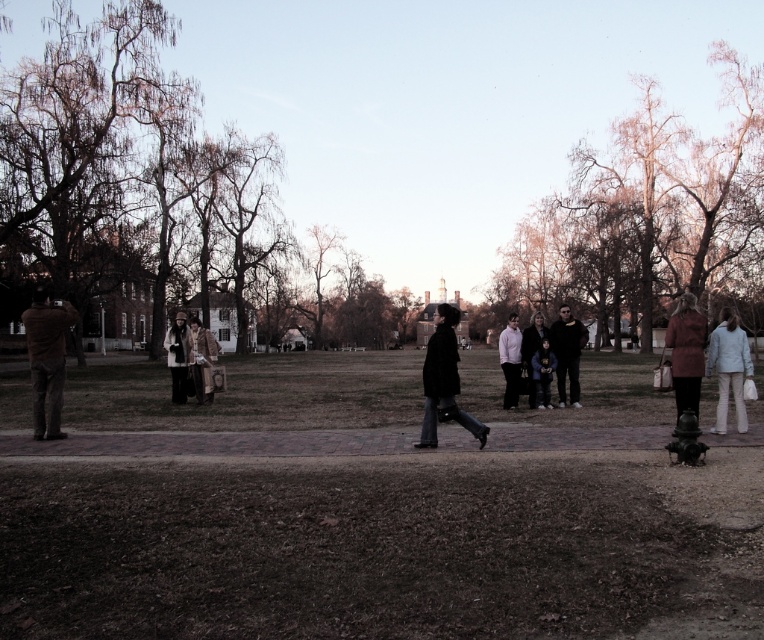
Which is more to the right, brown textured jacket at left or dark blue coat at center?

dark blue coat at center

Is brown textured jacket at left wider than dark blue coat at center?

Indeed, brown textured jacket at left has a greater width compared to dark blue coat at center.

Who is more forward, (37, 426) or (525, 349)?

Point (37, 426) is more forward.

Locate an element on the screen. brown textured jacket at left is located at coordinates (47, 358).

Does brown leather jacket at center have a larger size compared to dark blue denim jacket at center?

Yes, brown leather jacket at center is bigger than dark blue denim jacket at center.

Locate an element on the screen. The height and width of the screenshot is (640, 764). brown leather jacket at center is located at coordinates (201, 358).

Is dark blue coat at center bigger than dark blue denim jacket at center?

Yes.

Can you confirm if dark blue coat at center is wider than dark blue denim jacket at center?

Correct, the width of dark blue coat at center exceeds that of dark blue denim jacket at center.

Image resolution: width=764 pixels, height=640 pixels. Describe the element at coordinates (531, 353) in the screenshot. I see `dark blue coat at center` at that location.

Locate an element on the screen. This screenshot has height=640, width=764. dark blue coat at center is located at coordinates (531, 353).